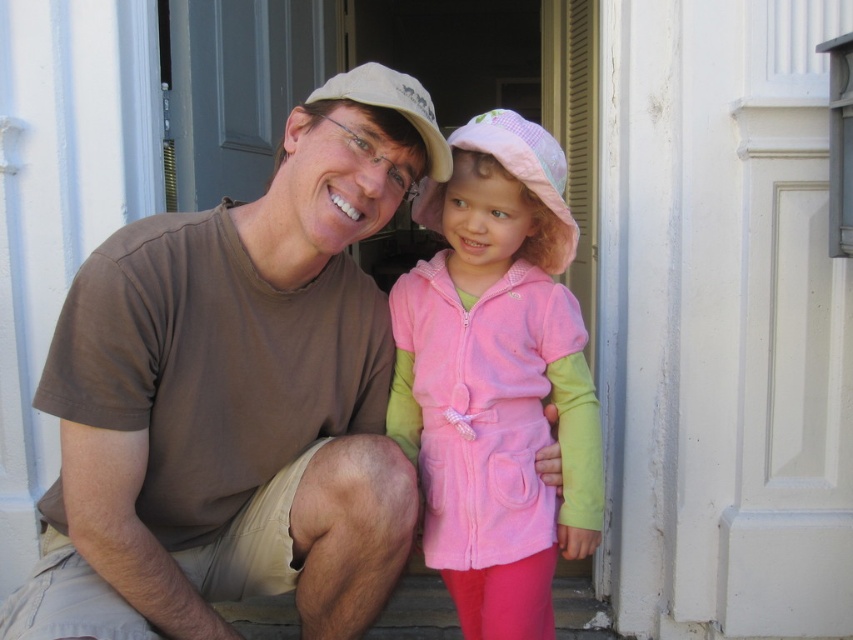
Is brown cotton t-shirt at left taller than pink fleece jacket at center?

No, brown cotton t-shirt at left is not taller than pink fleece jacket at center.

Can you confirm if brown cotton t-shirt at left is wider than pink fleece jacket at center?

Indeed, brown cotton t-shirt at left has a greater width compared to pink fleece jacket at center.

The width and height of the screenshot is (853, 640). What are the coordinates of `brown cotton t-shirt at left` in the screenshot? It's located at (236, 396).

Find the location of a particular element. The height and width of the screenshot is (640, 853). brown cotton t-shirt at left is located at coordinates (236, 396).

Is pink fleece jacket at center thinner than gray matte door at upper center?

No.

Describe the element at coordinates (496, 380) in the screenshot. I see `pink fleece jacket at center` at that location.

Between point (431, 508) and point (238, 129), which one is positioned in front?

Point (431, 508) is more forward.

This screenshot has width=853, height=640. I want to click on pink fleece jacket at center, so click(x=496, y=380).

Is the position of brown cotton t-shirt at left less distant than that of matte beige baseball cap at center?

Yes, it is in front of matte beige baseball cap at center.

Which of these two, brown cotton t-shirt at left or matte beige baseball cap at center, stands shorter?

Standing shorter between the two is matte beige baseball cap at center.

The image size is (853, 640). What do you see at coordinates (236, 396) in the screenshot?
I see `brown cotton t-shirt at left` at bounding box center [236, 396].

Locate an element on the screen. The image size is (853, 640). brown cotton t-shirt at left is located at coordinates (236, 396).